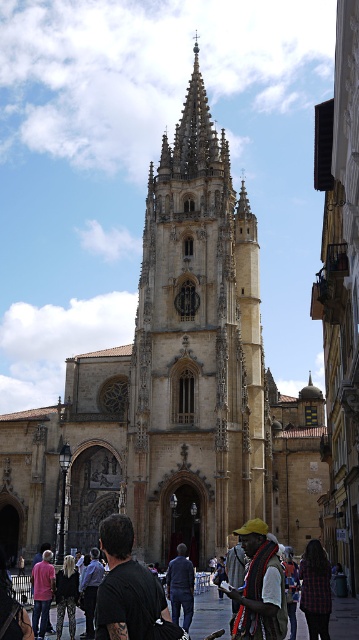
You are standing in front of the cathedral and see two points marked on the image. The first point is at coordinates point [45,557] and the second point is at point [288,596]. Which point is closer to you?

Point [45,557] is further to the camera than point [288,596]. Therefore, the point closer to you is point [288,596].

You are standing at the base of the cathedral, and you want to reach the point marked as point (44, 579). If your walking speed is 3 feet per second, how many seconds will it take you to reach that point?

The distance between you and point (44, 579) is 224.04 feet. At a speed of 3 feet per second, it will take 224.04 divided by 3, which is approximately 74.68 seconds to reach the point.

You are a visitor standing in front of the cathedral. You notice the golden stone tower at center and the dark blue shirt at center. Which object is taller?

The golden stone tower at center is much taller than the dark blue shirt at center.